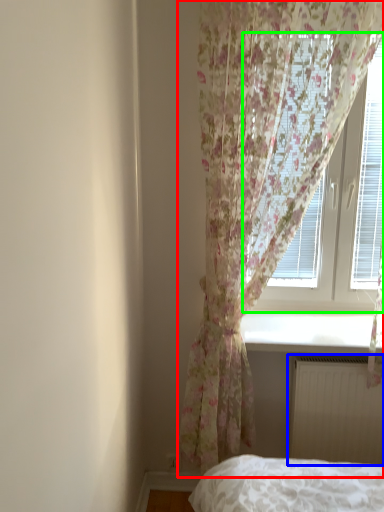
Question: Which object is positioned closest to curtain (highlighted by a red box)? Select from radiator (highlighted by a blue box) and window (highlighted by a green box).

Choices:
 (A) radiator
 (B) window

Answer: (B)